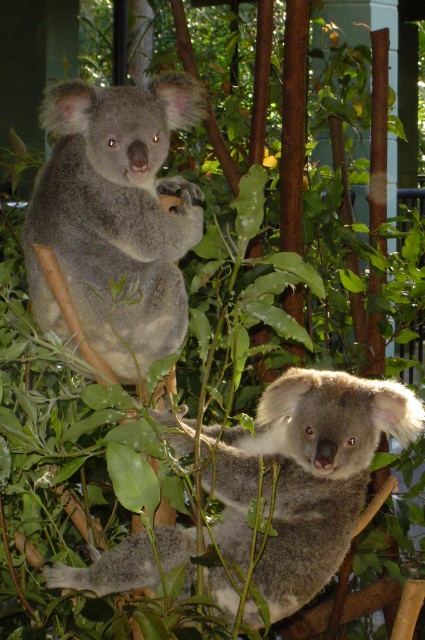
Is the position of gray furry koala at upper left more distant than that of fuzzy gray koala at center?

Yes.

Locate an element on the screen. The image size is (425, 640). gray furry koala at upper left is located at coordinates (116, 216).